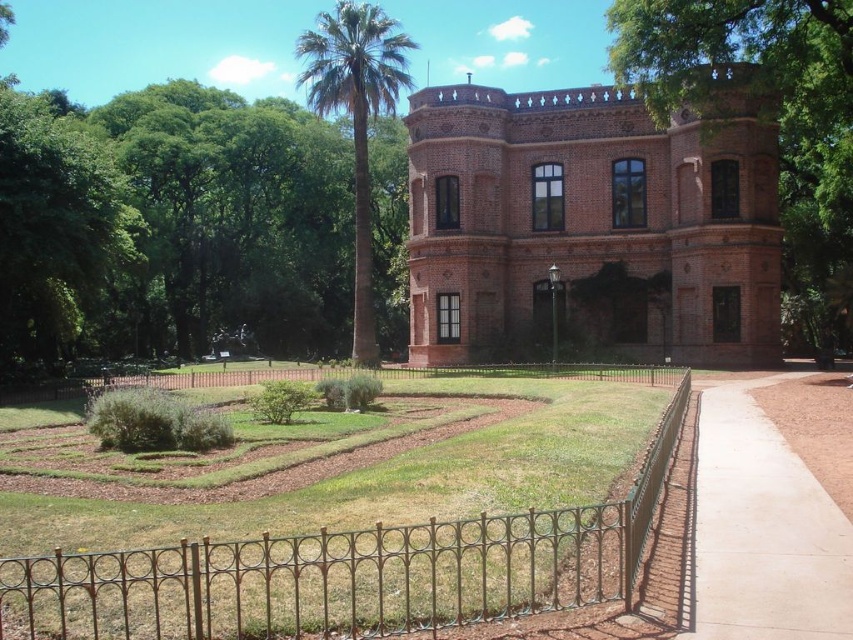
You are a visitor standing at the entrance of the historic brick building and want to take a photo of the green leafy tree at upper center. However, you notice the light brown concrete sidewalk at lower right might obstruct your view. Based on their positions, will the sidewalk block your view of the tree?

The light brown concrete sidewalk at lower right is behind the green leafy tree at upper center, so it will not block your view of the tree.